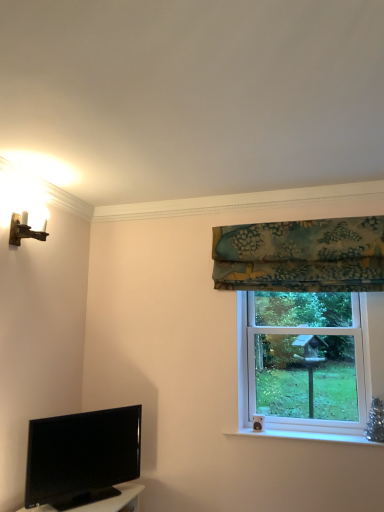
Locate an element on the screen. This screenshot has height=512, width=384. clear glass window at right is located at coordinates (301, 379).

What is the approximate height of teal floral fabric at upper right?

The height of teal floral fabric at upper right is 51.78 centimeters.

Locate an element on the screen. teal floral fabric at upper right is located at coordinates (301, 255).

Identify the location of black glossy tv at lower left. Image resolution: width=384 pixels, height=512 pixels. click(x=84, y=462).

What's the angular difference between clear glass window at right and teal floral fabric at upper right's facing directions?

0.797 degrees separate the facing orientations of clear glass window at right and teal floral fabric at upper right.

From the image's perspective, is clear glass window at right positioned above or below teal floral fabric at upper right?

Clearly, from the image's perspective, clear glass window at right is below teal floral fabric at upper right.

Which is more to the left, clear glass window at right or teal floral fabric at upper right?

teal floral fabric at upper right is more to the left.

In the scene shown: Who is smaller, clear glass window at right or teal floral fabric at upper right?

With smaller size is teal floral fabric at upper right.

Considering the sizes of objects clear glass window at right and wooden wall sconce at upper left in the image provided, who is wider, clear glass window at right or wooden wall sconce at upper left?

With larger width is clear glass window at right.

Is wooden wall sconce at upper left at the back of clear glass window at right?

That's not correct — clear glass window at right is not looking away from wooden wall sconce at upper left.

Is clear glass window at right taller or shorter than wooden wall sconce at upper left?

Clearly, clear glass window at right is taller compared to wooden wall sconce at upper left.

Which point is more forward, (360, 384) or (36, 233)?

The point (36, 233) is more forward.

How far apart are teal floral fabric at upper right and black glossy tv at lower left?

teal floral fabric at upper right and black glossy tv at lower left are 1.43 meters apart.

In the scene shown: Is the position of teal floral fabric at upper right less distant than that of black glossy tv at lower left?

No, it is behind black glossy tv at lower left.

From a real-world perspective, relative to black glossy tv at lower left, is teal floral fabric at upper right vertically above or below?

teal floral fabric at upper right is situated higher than black glossy tv at lower left in the real world.

Is teal floral fabric at upper right shorter than black glossy tv at lower left?

In fact, teal floral fabric at upper right may be taller than black glossy tv at lower left.

Consider the image. Which object is more forward, wooden wall sconce at upper left or teal floral fabric at upper right?

Positioned in front is wooden wall sconce at upper left.

From a real-world perspective, is wooden wall sconce at upper left on top of teal floral fabric at upper right?

Yes, from a real-world perspective, wooden wall sconce at upper left is above teal floral fabric at upper right.

Who is shorter, wooden wall sconce at upper left or teal floral fabric at upper right?

wooden wall sconce at upper left.

How many degrees apart are the facing directions of wooden wall sconce at upper left and teal floral fabric at upper right?

The facing directions of wooden wall sconce at upper left and teal floral fabric at upper right are 87.7 degrees apart.

This screenshot has width=384, height=512. Find the location of `light fixture in front of the clear glass window at right`. light fixture in front of the clear glass window at right is located at coordinates (24, 229).

Is wooden wall sconce at upper left closer to camera compared to clear glass window at right?

Yes, wooden wall sconce at upper left is in front of clear glass window at right.

From a real-world perspective, is wooden wall sconce at upper left on top of clear glass window at right?

Correct, in the physical world, wooden wall sconce at upper left is higher than clear glass window at right.

Which object is wider, wooden wall sconce at upper left or clear glass window at right?

Wider between the two is clear glass window at right.

Looking at this image, considering the relative sizes of clear glass window at right and black glossy tv at lower left in the image provided, is clear glass window at right smaller than black glossy tv at lower left?

No, clear glass window at right is not smaller than black glossy tv at lower left.

Is point (342, 409) closer or farther from the camera than point (45, 426)?

Point (342, 409).

Is clear glass window at right shorter than black glossy tv at lower left?

In fact, clear glass window at right may be taller than black glossy tv at lower left.

In the scene shown: Could you tell me if clear glass window at right is turned towards black glossy tv at lower left?

No, clear glass window at right is not aimed at black glossy tv at lower left.

From the image's perspective, is black glossy tv at lower left on top of teal floral fabric at upper right?

No, from the image's perspective, black glossy tv at lower left is not over teal floral fabric at upper right.

I want to click on television in front of the teal floral fabric at upper right, so click(x=84, y=462).

Relative to teal floral fabric at upper right, is black glossy tv at lower left in front or behind?

black glossy tv at lower left is positioned closer to the viewer than teal floral fabric at upper right.

In the image, there is a clear glass window at right. Identify the location of curtain above it (from the image's perspective). This screenshot has width=384, height=512. (301, 255).

This screenshot has height=512, width=384. I want to click on light fixture lying in front of the clear glass window at right, so click(24, 229).

Considering their positions, is wooden wall sconce at upper left positioned closer to black glossy tv at lower left than teal floral fabric at upper right?

Among the two, wooden wall sconce at upper left is located nearer to black glossy tv at lower left.

From the image, which object appears to be nearer to black glossy tv at lower left, wooden wall sconce at upper left or clear glass window at right?

clear glass window at right is positioned closer to the anchor black glossy tv at lower left.

Based on their spatial positions, is black glossy tv at lower left or wooden wall sconce at upper left further from teal floral fabric at upper right?

The object further to teal floral fabric at upper right is wooden wall sconce at upper left.

Considering their positions, is teal floral fabric at upper right positioned further to clear glass window at right than wooden wall sconce at upper left?

wooden wall sconce at upper left is positioned further to the anchor clear glass window at right.

Based on their spatial positions, is teal floral fabric at upper right or clear glass window at right further from wooden wall sconce at upper left?

Among the two, clear glass window at right is located further to wooden wall sconce at upper left.

From the image, which object appears to be farther from wooden wall sconce at upper left, black glossy tv at lower left or teal floral fabric at upper right?

teal floral fabric at upper right.

Based on their spatial positions, is wooden wall sconce at upper left or teal floral fabric at upper right further from clear glass window at right?

wooden wall sconce at upper left.

Based on their spatial positions, is teal floral fabric at upper right or black glossy tv at lower left further from wooden wall sconce at upper left?

Among the two, teal floral fabric at upper right is located further to wooden wall sconce at upper left.

The width and height of the screenshot is (384, 512). What are the coordinates of `curtain situated between black glossy tv at lower left and clear glass window at right from left to right` in the screenshot? It's located at (301, 255).

Locate an element on the screen. The height and width of the screenshot is (512, 384). curtain between wooden wall sconce at upper left and clear glass window at right in the horizontal direction is located at coordinates (301, 255).

You are a GUI agent. You are given a task and a screenshot of the screen. Output one action in this format:
    pyautogui.click(x=<x>, y=<y>)
    Task: Click on the television between wooden wall sconce at upper left and teal floral fabric at upper right in the horizontal direction
    
    Given the screenshot: What is the action you would take?
    pyautogui.click(x=84, y=462)

What are the coordinates of `television between wooden wall sconce at upper left and clear glass window at right in the horizontal direction` in the screenshot? It's located at (84, 462).